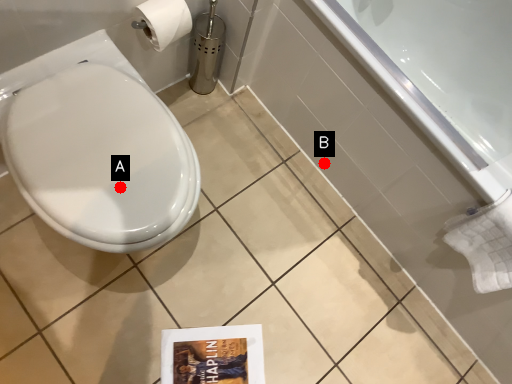
Question: Two points are circled on the image, labeled by A and B beside each circle. Which point is closer to the camera?

Choices:
 (A) A is closer
 (B) B is closer

Answer: (A)